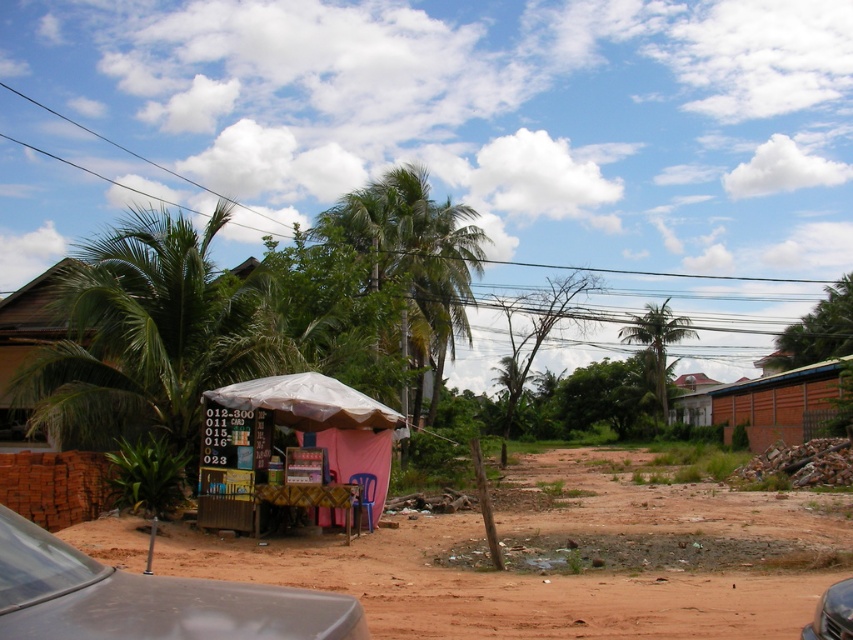
Is green leafy palm tree at left positioned at the back of green leafy palm tree at center-right?

No.

Is green leafy palm tree at left to the left of green leafy palm tree at center-right from the viewer's perspective?

Indeed, green leafy palm tree at left is positioned on the left side of green leafy palm tree at center-right.

Does point (91, 340) come farther from viewer compared to point (677, 324)?

No, it is in front of (677, 324).

What are the coordinates of `green leafy palm tree at left` in the screenshot? It's located at (148, 337).

Is green leafy palm tree at left positioned behind metallic gray car at lower left?

Yes, green leafy palm tree at left is further from the viewer.

How much distance is there between green leafy palm tree at left and metallic gray car at lower left?

A distance of 12.00 meters exists between green leafy palm tree at left and metallic gray car at lower left.

Is point (115, 358) closer to viewer compared to point (120, 608)?

No, it is behind (120, 608).

At what (x,y) coordinates should I click in order to perform the action: click on green leafy palm tree at left. Please return your answer as a coordinate pair (x, y). The height and width of the screenshot is (640, 853). Looking at the image, I should click on (148, 337).

Does green leafy palm tree at center-right have a greater width compared to metallic gray car at lower right?

Yes.

Is point (648, 320) farther from viewer compared to point (827, 634)?

Yes, point (648, 320) is farther from viewer.

Image resolution: width=853 pixels, height=640 pixels. In order to click on green leafy palm tree at center-right in this screenshot , I will do `click(657, 340)`.